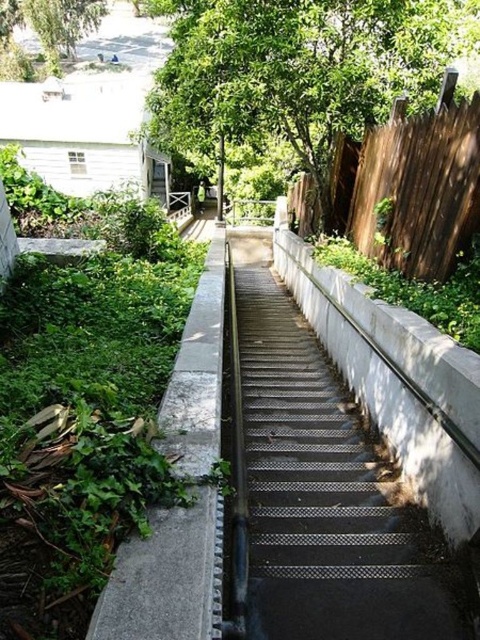
Is point (287, 365) in front of point (402, 147)?

No, it is behind (402, 147).

Is metallic mesh stairs at center smaller than brown wooden fence at upper right?

Yes, metallic mesh stairs at center is smaller than brown wooden fence at upper right.

Does point (286, 422) come closer to viewer compared to point (343, 216)?

Yes.

Image resolution: width=480 pixels, height=640 pixels. Find the location of `metallic mesh stairs at center`. metallic mesh stairs at center is located at coordinates (324, 492).

Can you confirm if gray concrete wall at left is smaller than green leafy tree at upper left?

Indeed, gray concrete wall at left has a smaller size compared to green leafy tree at upper left.

Does gray concrete wall at left appear on the left side of green leafy tree at upper left?

No, gray concrete wall at left is not to the left of green leafy tree at upper left.

Describe the element at coordinates (167, 577) in the screenshot. The height and width of the screenshot is (640, 480). I see `gray concrete wall at left` at that location.

The image size is (480, 640). I want to click on gray concrete wall at left, so click(167, 577).

Between point (288, 593) and point (187, 548), which one is positioned behind?

The point (288, 593) is behind.

Who is positioned more to the left, metallic mesh stairs at center or gray concrete wall at left?

gray concrete wall at left

Image resolution: width=480 pixels, height=640 pixels. Describe the element at coordinates (324, 492) in the screenshot. I see `metallic mesh stairs at center` at that location.

Locate an element on the screen. This screenshot has width=480, height=640. metallic mesh stairs at center is located at coordinates (324, 492).